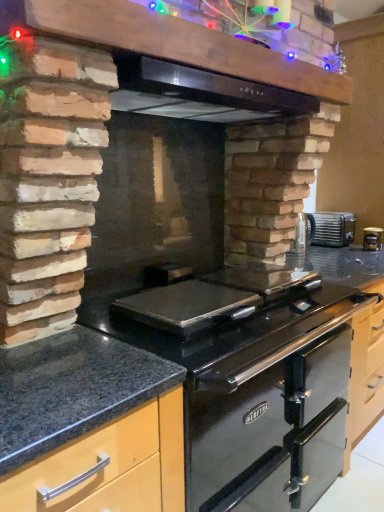
Question: Considering the positions of matte black canister at upper right and metallic black vent at upper center in the image, is matte black canister at upper right bigger or smaller than metallic black vent at upper center?

Choices:
 (A) big
 (B) small

Answer: (B)

Question: From a real-world perspective, relative to metallic black vent at upper center, is matte black canister at upper right vertically above or below?

Choices:
 (A) below
 (B) above

Answer: (A)

Question: Which of these objects is positioned farthest from the metallic silver toaster at upper center?

Choices:
 (A) black stainless steel exhaust hood at upper center
 (B) granite at center, which is the first countertop in left-to-right order
 (C) metallic black vent at upper center
 (D) matte black canister at upper right
 (E) black stainless steel gas stove at center

Answer: (B)

Question: Based on their relative distances, which object is farther from the metallic black vent at upper center?

Choices:
 (A) black stainless steel gas stove at center
 (B) black stainless steel exhaust hood at upper center
 (C) granite countertop at lower left, the 1th countertop viewed from the right
 (D) granite at center, which is the first countertop in left-to-right order
 (E) metallic silver toaster at upper center

Answer: (E)